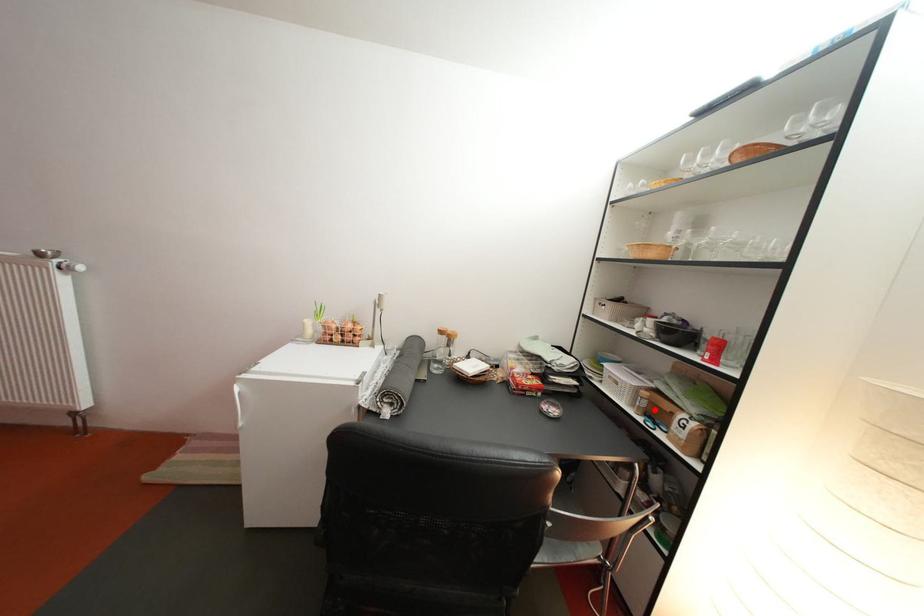
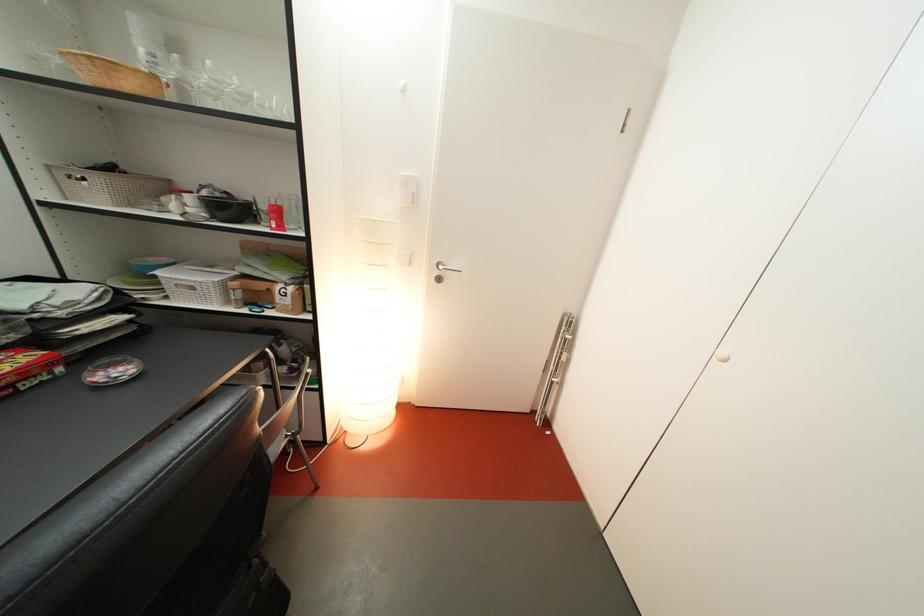
Find the pixel in the second image that matches the highlighted location in the first image.

(249, 301)